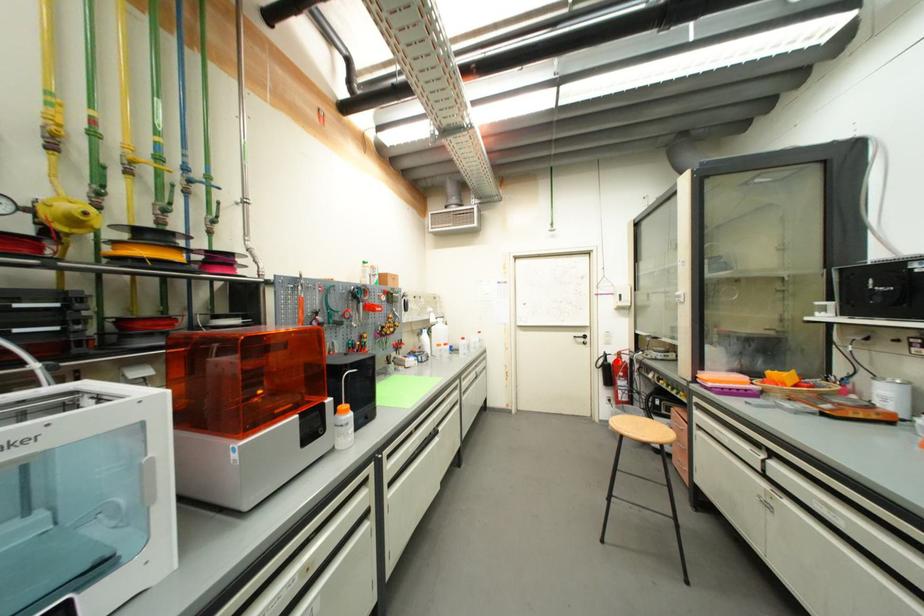
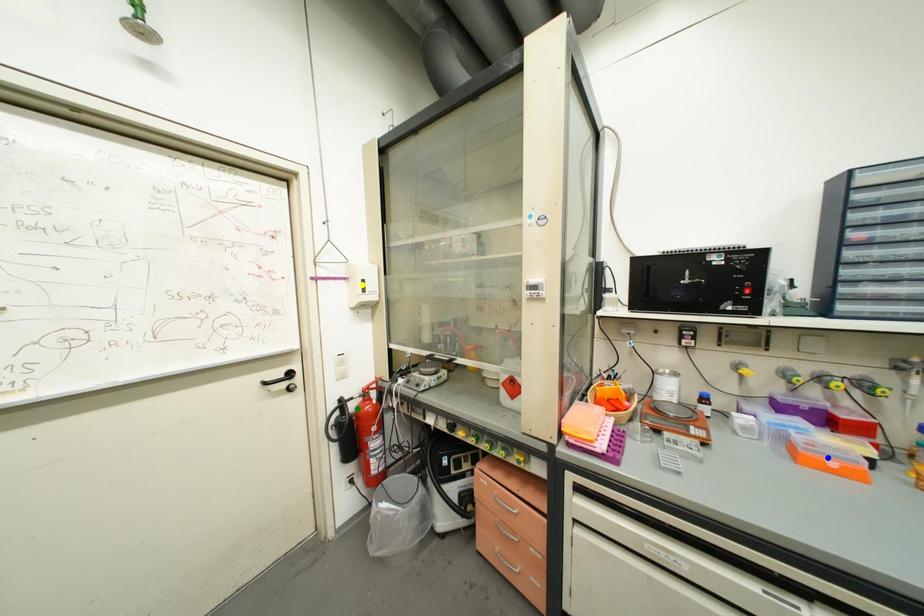
Question: I am providing you with two images of the same scene from different viewpoints. A red point is marked on the first image. You are given multiple points on the second image. Which point in image 2 represents the same 3d spot as the red point in image 1?

Choices:
 (A) yellow point
 (B) blue point
 (C) green point

Answer: (C)